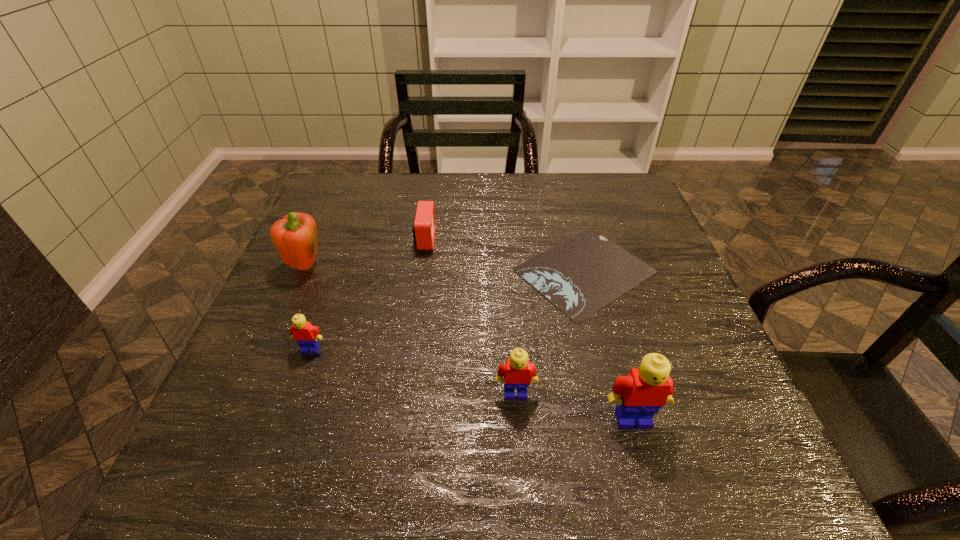
Find the location of a particular element. vacant area in the image that satisfies the following two spatial constraints: 1. on the front-facing side of the third object from left to right; 2. on the right side of the shortest object is located at coordinates (420, 271).